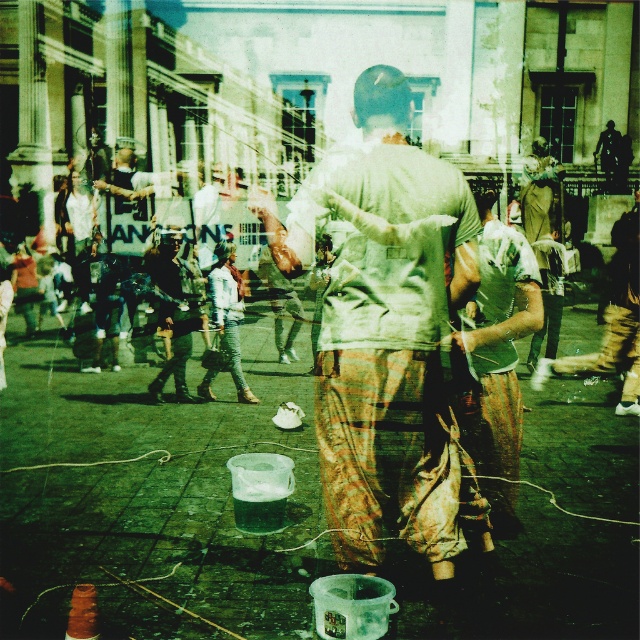
You are a photographer trying to capture both the light gray cotton shirt at center and the green fabric shirt at center in a clear shot. Since the scene is blurred due to motion, which shirt should you focus on to ensure it appears less blurry given their sizes?

The light gray cotton shirt at center is larger in size than the green fabric shirt at center, so focusing on the larger light gray cotton shirt at center would be more effective to reduce blurriness as larger objects generally hold focus better in motion shots.